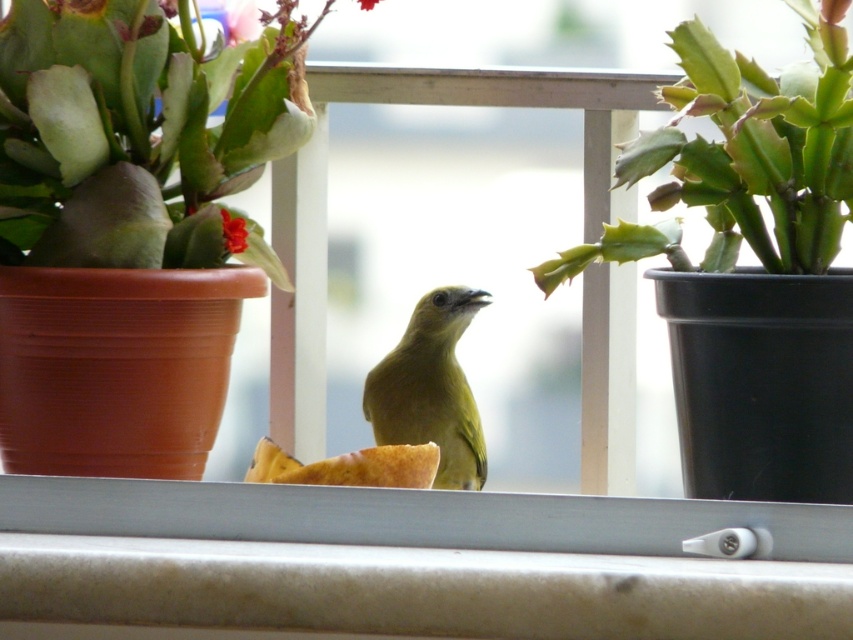
Between metallic silver frame at center and pink matte flower at upper left, which one has less height?

Standing shorter between the two is pink matte flower at upper left.

Who is positioned more to the right, metallic silver frame at center or pink matte flower at upper left?

Positioned to the right is metallic silver frame at center.

Which is behind, point (62, 536) or point (227, 6)?

The point (227, 6) is more distant.

Where is `metallic silver frame at center`? metallic silver frame at center is located at coordinates (415, 561).

The image size is (853, 640). What do you see at coordinates (138, 131) in the screenshot?
I see `green matte succulent at left` at bounding box center [138, 131].

Identify the location of green matte succulent at left. The image size is (853, 640). (138, 131).

You are a GUI agent. You are given a task and a screenshot of the screen. Output one action in this format:
    pyautogui.click(x=<x>, y=<y>)
    Task: Click on the green matte succulent at left
    The height and width of the screenshot is (640, 853).
    Given the screenshot: What is the action you would take?
    pyautogui.click(x=138, y=131)

Between green matte succulent at left and smooth red flower at center, which one has more height?

With more height is green matte succulent at left.

Who is more forward, (171, 72) or (238, 228)?

Point (171, 72) is in front.

You are a GUI agent. You are given a task and a screenshot of the screen. Output one action in this format:
    pyautogui.click(x=<x>, y=<y>)
    Task: Click on the green matte succulent at left
    This screenshot has height=640, width=853.
    Given the screenshot: What is the action you would take?
    pyautogui.click(x=138, y=131)